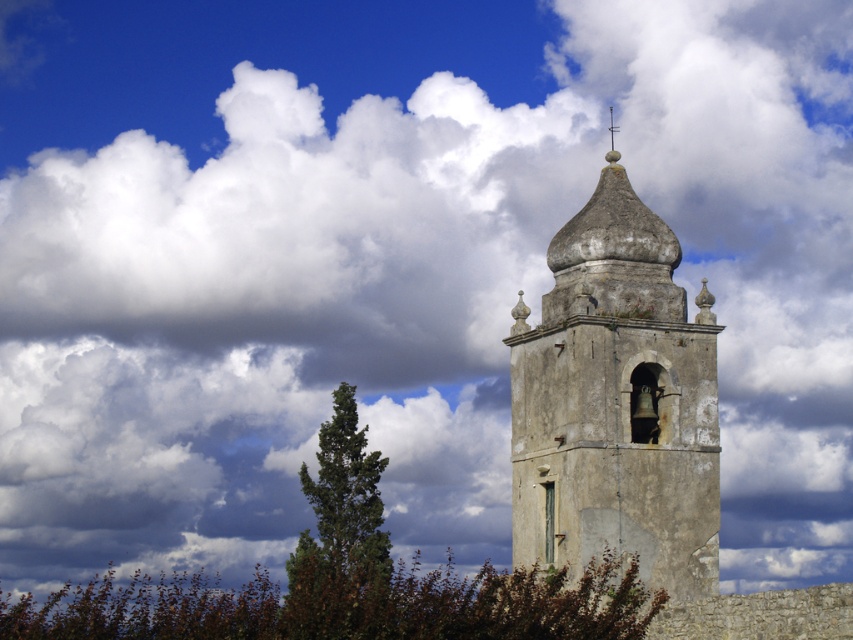
Who is positioned more to the right, green textured tree at center-left or smooth stone spire at upper center?

smooth stone spire at upper center is more to the right.

Does green textured tree at center-left appear on the right side of smooth stone spire at upper center?

In fact, green textured tree at center-left is to the left of smooth stone spire at upper center.

Who is more forward, (347, 512) or (610, 118)?

Point (347, 512)

Where is `green textured tree at center-left`? This screenshot has height=640, width=853. green textured tree at center-left is located at coordinates (341, 508).

Does weathered stone bell tower at center appear on the right side of green textured tree at center-left?

Correct, you'll find weathered stone bell tower at center to the right of green textured tree at center-left.

How distant is weathered stone bell tower at center from green textured tree at center-left?

47.85 feet

Is point (656, 515) farther from viewer compared to point (352, 577)?

No.

Locate an element on the screen. This screenshot has width=853, height=640. weathered stone bell tower at center is located at coordinates (616, 403).

Between brown textured tree at lower center and smooth stone spire at upper center, which one has more height?

brown textured tree at lower center

Which is more to the right, brown textured tree at lower center or smooth stone spire at upper center?

From the viewer's perspective, smooth stone spire at upper center appears more on the right side.

You are a GUI agent. You are given a task and a screenshot of the screen. Output one action in this format:
    pyautogui.click(x=<x>, y=<y>)
    Task: Click on the brown textured tree at lower center
    
    Given the screenshot: What is the action you would take?
    pyautogui.click(x=344, y=604)